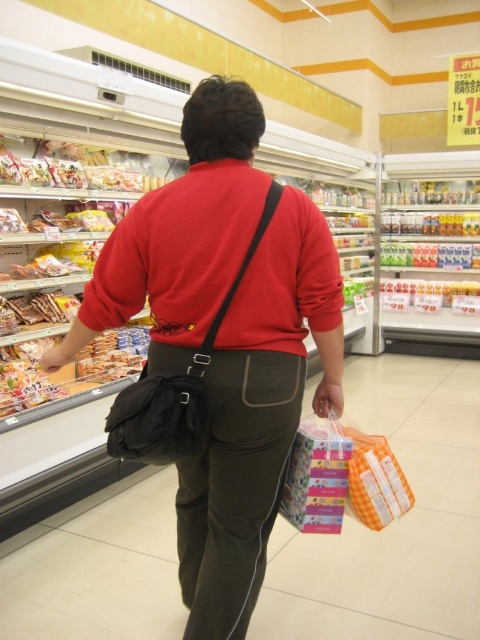
Can you confirm if matte black bag at center is smaller than black fabric bag at back?

Actually, matte black bag at center might be larger than black fabric bag at back.

Does matte black bag at center come in front of black fabric bag at back?

No, it is behind black fabric bag at back.

Identify the location of matte black bag at center. (255, 416).